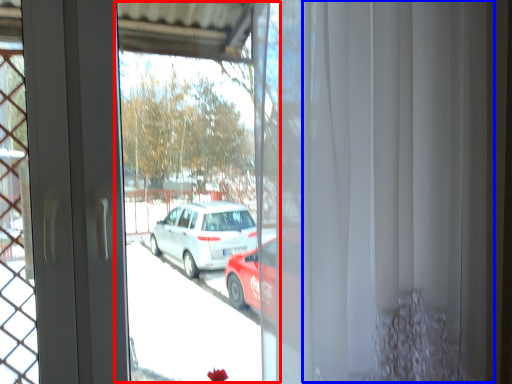
Question: Which object is closer to the camera taking this photo, shop window (highlighted by a red box) or curtain (highlighted by a blue box)?

Choices:
 (A) shop window
 (B) curtain

Answer: (B)